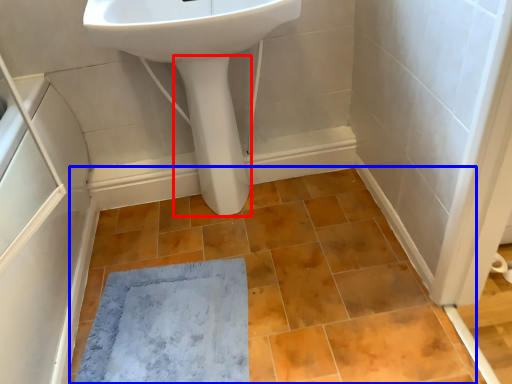
Question: Among these objects, which one is nearest to the camera, bidet (highlighted by a red box) or ceramic tile (highlighted by a blue box)?

Choices:
 (A) bidet
 (B) ceramic tile

Answer: (B)